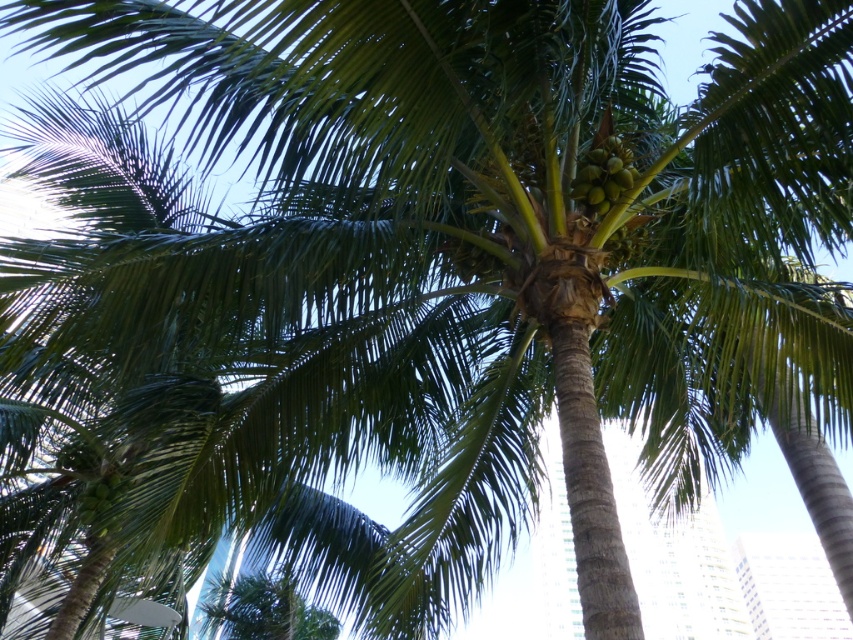
Question: Does green matte coconuts at upper center appear on the right side of green matte coconuts at upper left?

Choices:
 (A) no
 (B) yes

Answer: (B)

Question: Is green matte coconuts at upper center closer to camera compared to green matte coconuts at upper left?

Choices:
 (A) yes
 (B) no

Answer: (A)

Question: Which point is closer to the camera?

Choices:
 (A) green matte coconuts at upper left
 (B) green matte coconuts at upper center

Answer: (B)

Question: Which point is closer to the camera?

Choices:
 (A) (102, 502)
 (B) (601, 147)

Answer: (B)

Question: Does green matte coconuts at upper center lie behind green matte coconuts at upper left?

Choices:
 (A) no
 (B) yes

Answer: (A)